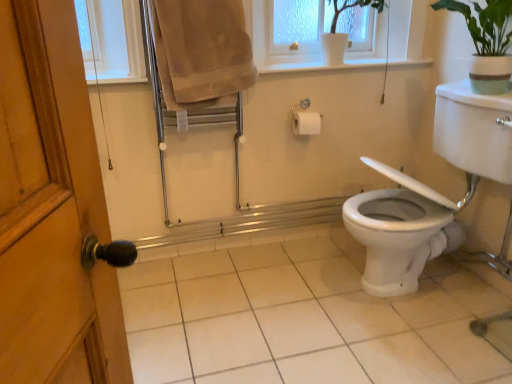
Question: From a real-world perspective, is white glossy sink at right physically below black rubber grab bar at lower left?

Choices:
 (A) yes
 (B) no

Answer: (B)

Question: From a real-world perspective, is white glossy sink at right over black rubber grab bar at lower left?

Choices:
 (A) no
 (B) yes

Answer: (B)

Question: Is white glossy sink at right wider than black rubber grab bar at lower left?

Choices:
 (A) no
 (B) yes

Answer: (A)

Question: Does white glossy sink at right have a greater height compared to black rubber grab bar at lower left?

Choices:
 (A) no
 (B) yes

Answer: (B)

Question: Is white glossy sink at right closer to the viewer compared to black rubber grab bar at lower left?

Choices:
 (A) no
 (B) yes

Answer: (A)

Question: From the image's perspective, is white glossy sink at right located beneath black rubber grab bar at lower left?

Choices:
 (A) no
 (B) yes

Answer: (A)

Question: From a real-world perspective, is beige cotton towel at upper center over white ceramic pot at upper center?

Choices:
 (A) no
 (B) yes

Answer: (A)

Question: Would you say beige cotton towel at upper center contains white ceramic pot at upper center?

Choices:
 (A) no
 (B) yes

Answer: (A)

Question: Is beige cotton towel at upper center aimed at white ceramic pot at upper center?

Choices:
 (A) yes
 (B) no

Answer: (B)

Question: Does beige cotton towel at upper center lie behind white ceramic pot at upper center?

Choices:
 (A) no
 (B) yes

Answer: (A)

Question: Is beige cotton towel at upper center not near white ceramic pot at upper center?

Choices:
 (A) yes
 (B) no

Answer: (B)

Question: Considering the relative sizes of beige cotton towel at upper center and white ceramic pot at upper center in the image provided, is beige cotton towel at upper center wider than white ceramic pot at upper center?

Choices:
 (A) yes
 (B) no

Answer: (B)

Question: From a real-world perspective, is beige cotton towel at upper center on white glossy sink at right?

Choices:
 (A) no
 (B) yes

Answer: (B)